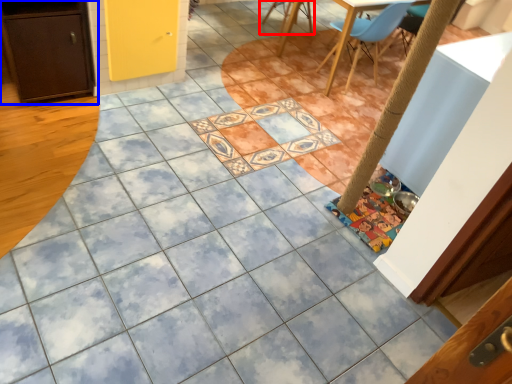
Question: Which object is closer to the camera taking this photo, chair (highlighted by a red box) or cabinetry (highlighted by a blue box)?

Choices:
 (A) chair
 (B) cabinetry

Answer: (B)